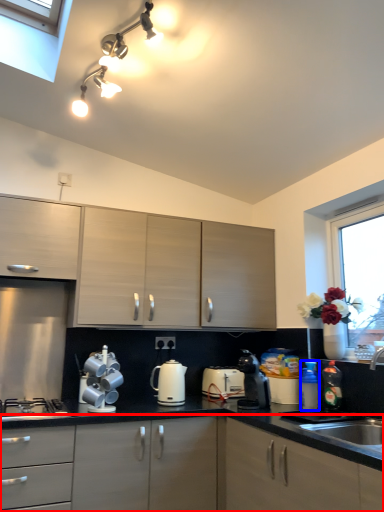
Question: Among these objects, which one is nearest to the camera, cabinetry (highlighted by a red box) or bottle (highlighted by a blue box)?

Choices:
 (A) cabinetry
 (B) bottle

Answer: (A)